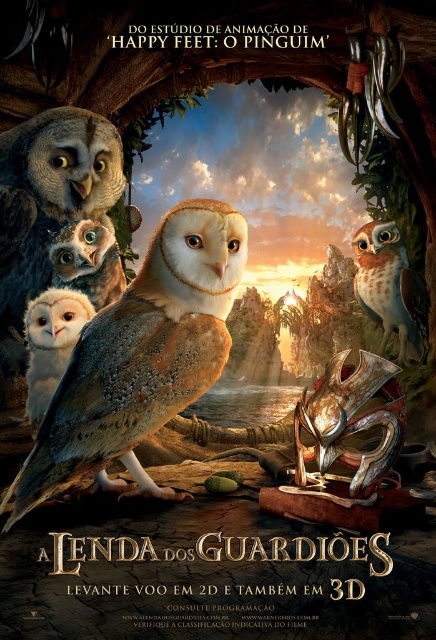
Based on the movie poster description, what are the coordinates of the brown speckled feathers owl at center?

The brown speckled feathers owl at center is located at coordinates point [142,353].